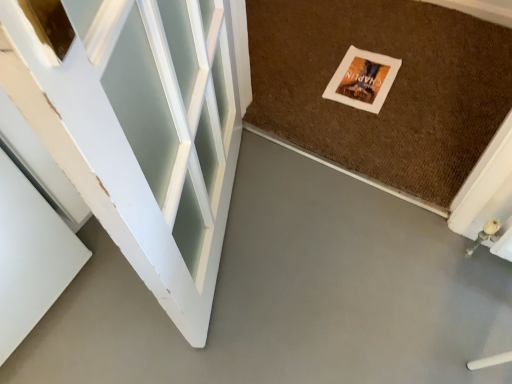
At what (x,y) coordinates should I click in order to perform the action: click on vacant space underneath matte paper postcard at center (from a real-world perspective). Please return your answer as a coordinate pair (x, y). Looking at the image, I should click on (365, 77).